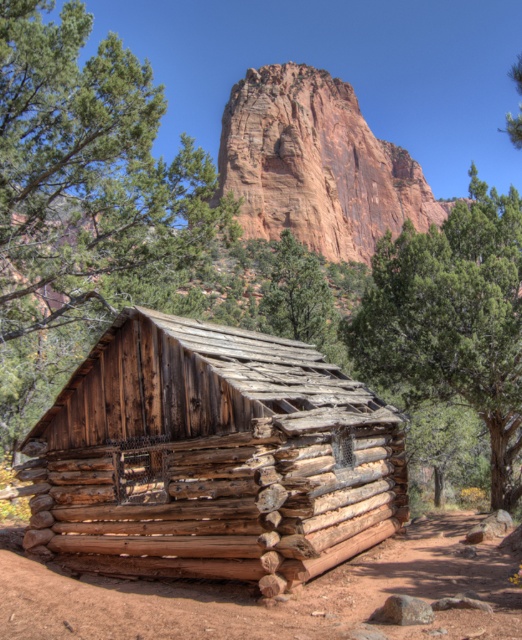
You are a hiker trying to determine the safest path to the weathered wood cabin at center and the rustic stone mountain at center. Which structure is narrower and thus easier to navigate around?

The weathered wood cabin at center is thinner than the rustic stone mountain at center, so it is narrower and easier to navigate around.